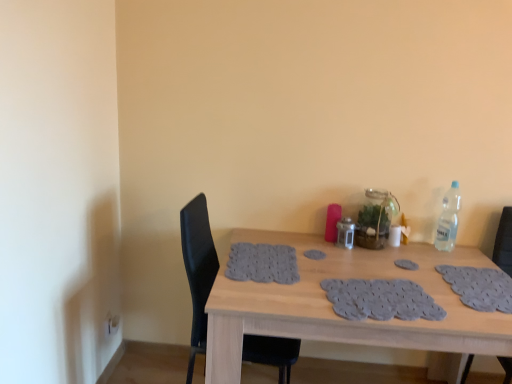
Find the location of `vacant position to the left of gray fabric placemat at center, placed as the second footprint when sorted from left to right`. vacant position to the left of gray fabric placemat at center, placed as the second footprint when sorted from left to right is located at coordinates (374, 264).